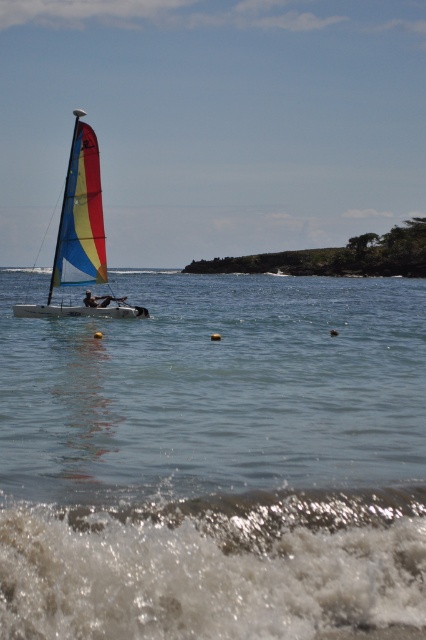
You are standing on the beach looking out at the scene. Which object is closer to you, the white frothy wave at lower center or the matte sailboat at left?

The white frothy wave at lower center is closer to you because it is positioned below the matte sailboat at left, indicating it is in a lower, more foreground position.